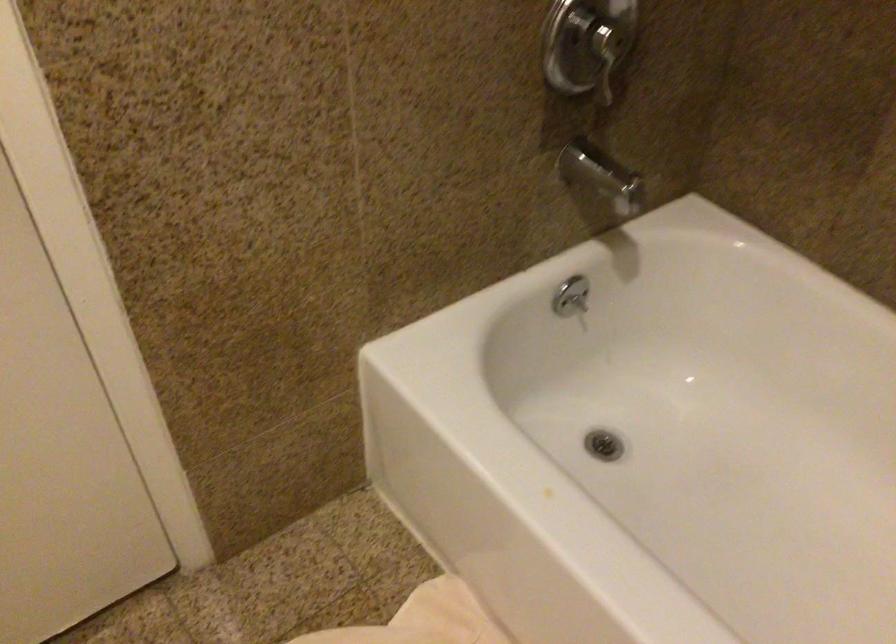
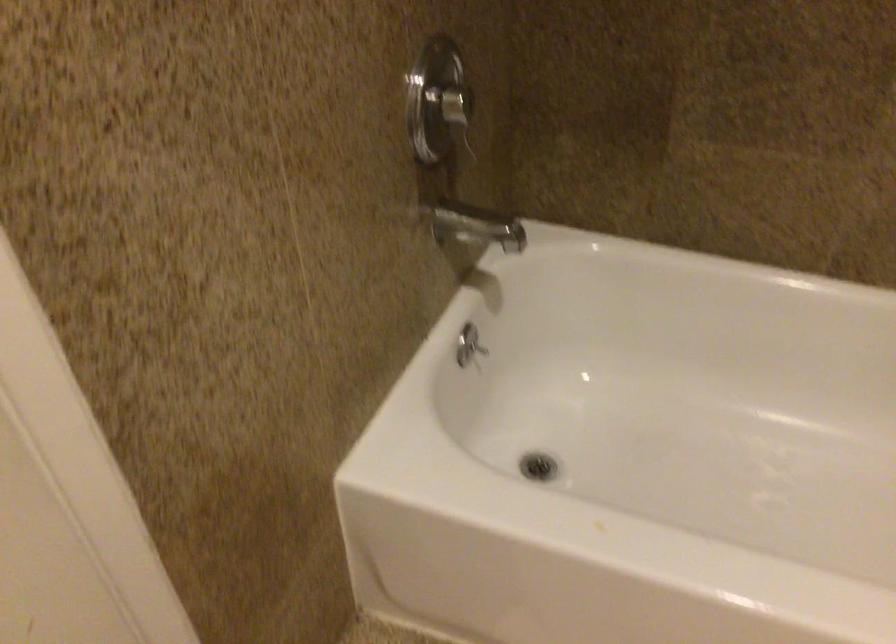
Question: The images are taken continuously from a first-person perspective. In which direction is your viewpoint rotating?

Choices:
 (A) Left
 (B) Right
 (C) Up
 (D) Down

Answer: (B)